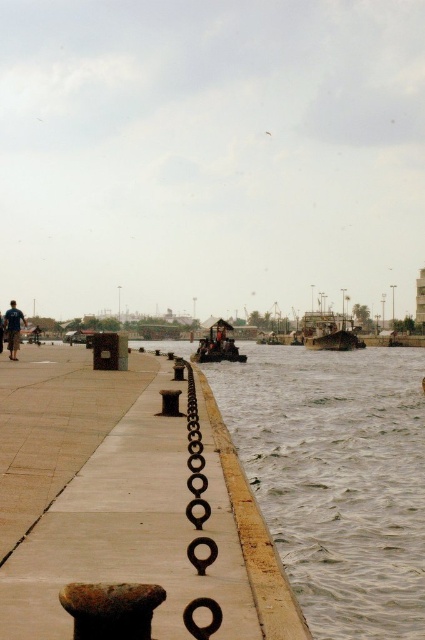
Question: Which object appears farthest from the camera in this image?

Choices:
 (A) wooden boat at center
 (B) blue denim shorts at left
 (C) rusty metal chain at center

Answer: (A)

Question: Estimate the real-world distances between objects in this image. Which object is farther from the rustic concrete pier at center?

Choices:
 (A) rusty metal chain at center
 (B) blue denim shorts at left
 (C) rusty metal boat at center
 (D) brown/rough water at center

Answer: (C)

Question: Is brown/rough water at center further to the viewer compared to rusty metal chain at center?

Choices:
 (A) no
 (B) yes

Answer: (B)

Question: Is rusty metal chain at center bigger than wooden boat at center?

Choices:
 (A) yes
 (B) no

Answer: (B)

Question: Which point is closer to the camera taking this photo?

Choices:
 (A) (229, 344)
 (B) (155, 554)

Answer: (B)

Question: Can you confirm if wooden boat at center is bigger than blue denim shorts at left?

Choices:
 (A) yes
 (B) no

Answer: (A)